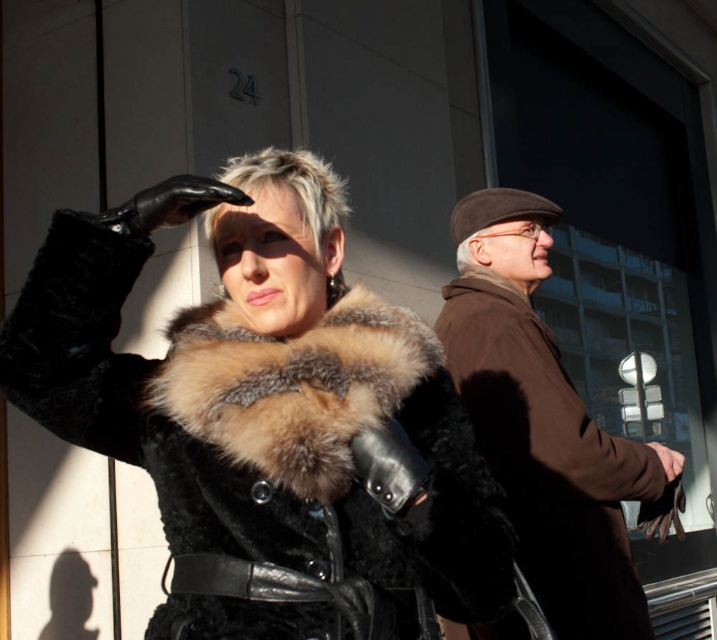
You are a fashion designer observing two coats in a photo. The fur coat at center and the brown woolen coat at right. Which coat is shorter in length?

The fur coat at center is shorter in length compared to the brown woolen coat at right.

You are standing at the origin of the coordinate system in the image. The fur coat at center is located at point (261, 388). If you want to move towards the fur coat at center, in which direction should you move?

To move towards the fur coat at center located at point (261, 388), you should move in the positive x and positive y direction since the coordinates are both greater than 0.